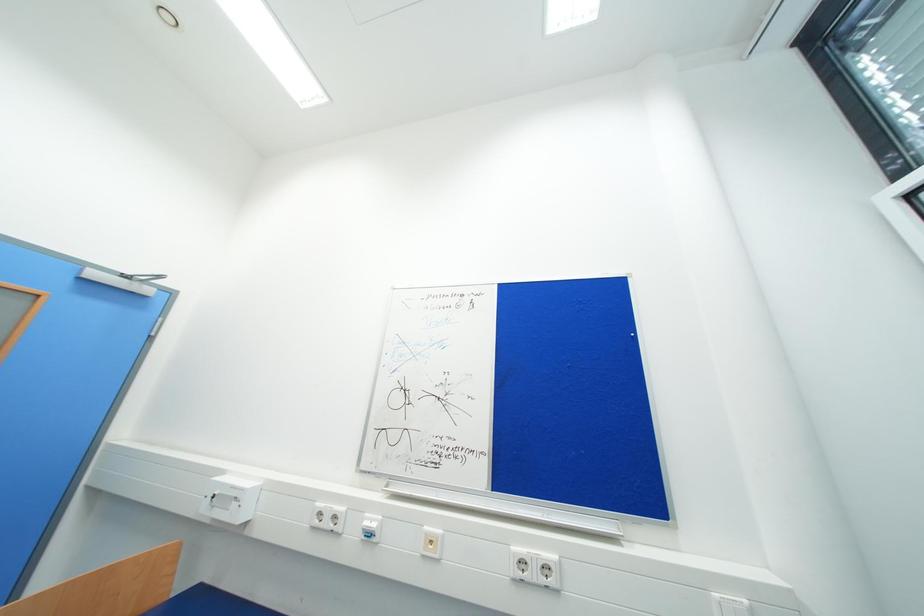
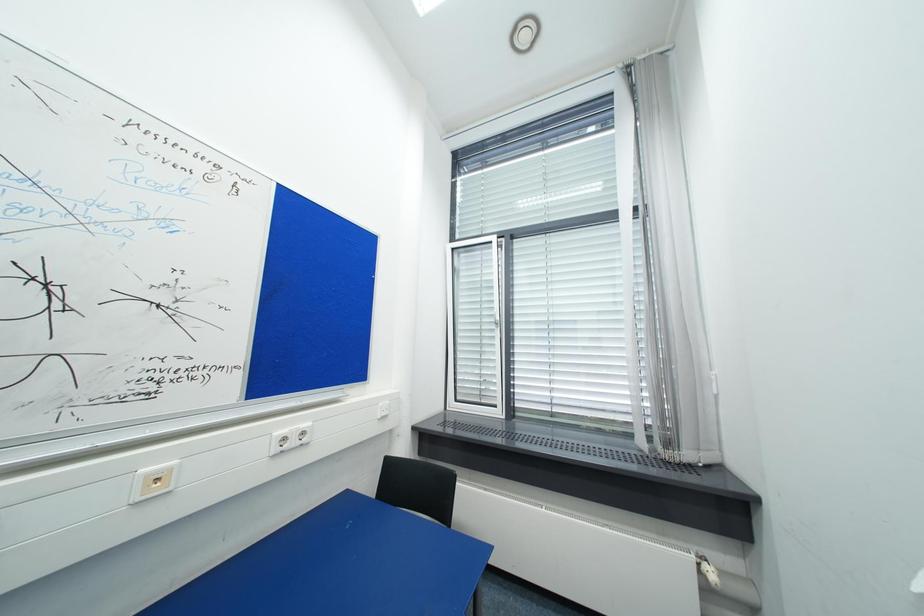
Question: The camera is either moving clockwise (left) or counter-clockwise (right) around the object. The first image is from the beginning of the video and the second image is from the end. Is the camera moving left or right when shooting the video?

Choices:
 (A) Left
 (B) Right

Answer: (A)